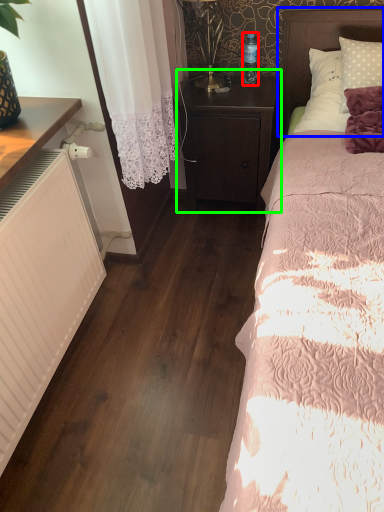
Question: Based on their relative distances, which object is nearer to bottle (highlighted by a red box)? Choose from headboard (highlighted by a blue box) and nightstand (highlighted by a green box).

Choices:
 (A) headboard
 (B) nightstand

Answer: (A)